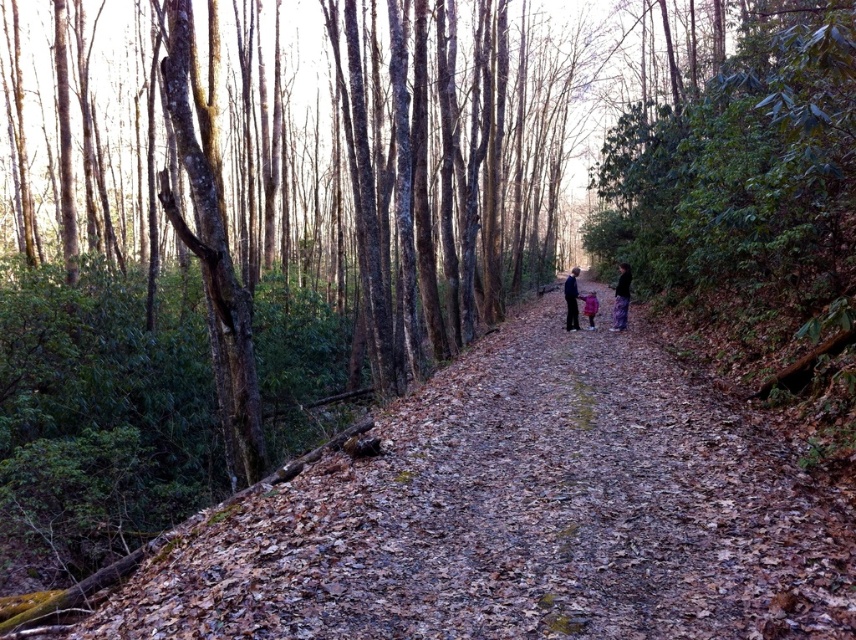
Question: Which of the following is the closest to the observer?

Choices:
 (A) (571, 269)
 (B) (681, 493)
 (C) (615, 316)

Answer: (B)

Question: Does floral skirt at center appear over dark blue jacket at center?

Choices:
 (A) no
 (B) yes

Answer: (A)

Question: Among these objects, which one is nearest to the camera?

Choices:
 (A) pink fleece jacket at center
 (B) brown leafy forest path at center

Answer: (B)

Question: Which point is farther to the camera?

Choices:
 (A) (627, 278)
 (B) (566, 278)
 (C) (626, 282)
 (D) (584, 314)

Answer: (B)

Question: Does floral skirt at center appear on the right side of dark blue jacket at center?

Choices:
 (A) no
 (B) yes

Answer: (B)

Question: Does brown leafy forest path at center have a lesser width compared to matte pink coat at center?

Choices:
 (A) yes
 (B) no

Answer: (B)